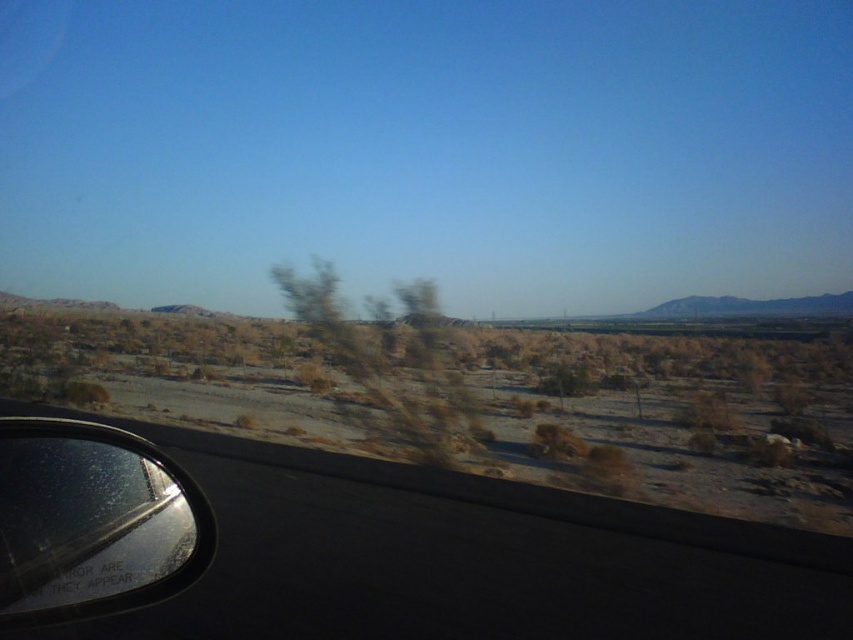
Does point (293, 324) come farther from viewer compared to point (53, 445)?

Yes.

Does brown sandy desert at lower left have a greater height compared to glossy plastic view mirror at lower left?

Yes, brown sandy desert at lower left is taller than glossy plastic view mirror at lower left.

Is point (543, 332) positioned before point (199, 557)?

No, it is not.

Locate an element on the screen. Image resolution: width=853 pixels, height=640 pixels. brown sandy desert at lower left is located at coordinates (679, 413).